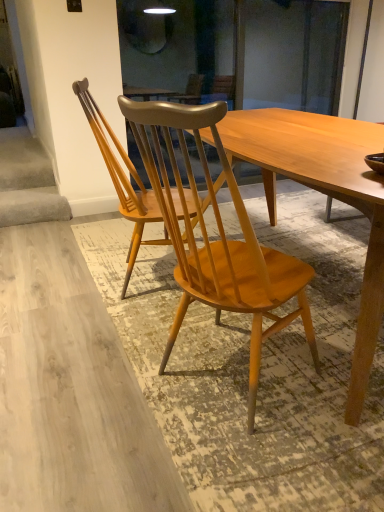
Find the location of `light brown wood chair at center, arranged as the second chair when viewed from the front`. light brown wood chair at center, arranged as the second chair when viewed from the front is located at coordinates (122, 180).

In order to face light brown wood chair at center, positioned as the 1th chair in back-to-front order, should I rotate leftwards or rightwards?

You should look left and rotate roughly 6.459 degrees.

Describe the element at coordinates (122, 180) in the screenshot. I see `light brown wood chair at center, arranged as the second chair when viewed from the front` at that location.

Where is `natural wood chair at center, acting as the first chair starting from the front`? This screenshot has width=384, height=512. natural wood chair at center, acting as the first chair starting from the front is located at coordinates (217, 240).

The image size is (384, 512). What do you see at coordinates (217, 240) in the screenshot?
I see `natural wood chair at center, arranged as the second chair when viewed from the back` at bounding box center [217, 240].

Measure the distance between point (244, 291) and camera.

Point (244, 291) and camera are 4.17 feet apart from each other.

Locate an element on the screen. The width and height of the screenshot is (384, 512). light brown wood chair at center, arranged as the second chair when viewed from the front is located at coordinates (122, 180).

Between natural wood chair at center, acting as the first chair starting from the front, and light brown wood chair at center, positioned as the 1th chair in back-to-front order, which one appears on the left side from the viewer's perspective?

light brown wood chair at center, positioned as the 1th chair in back-to-front order.

In the image, is natural wood chair at center, acting as the first chair starting from the front, positioned in front of or behind light brown wood chair at center, positioned as the 1th chair in back-to-front order?

In the image, natural wood chair at center, acting as the first chair starting from the front, appears in front of light brown wood chair at center, positioned as the 1th chair in back-to-front order.

Is point (220, 243) in front of point (149, 217)?

Yes.

From the image's perspective, between natural wood chair at center, acting as the first chair starting from the front, and light brown wood chair at center, arranged as the second chair when viewed from the front, which one is located above?

light brown wood chair at center, arranged as the second chair when viewed from the front, from the image's perspective.

From a real-world perspective, is natural wood chair at center, arranged as the second chair when viewed from the back, above or below light brown wood chair at center, arranged as the second chair when viewed from the front?

natural wood chair at center, arranged as the second chair when viewed from the back, is below light brown wood chair at center, arranged as the second chair when viewed from the front.

Which of these two, natural wood chair at center, acting as the first chair starting from the front, or light brown wood chair at center, arranged as the second chair when viewed from the front, is wider?

With larger width is light brown wood chair at center, arranged as the second chair when viewed from the front.

Considering the sizes of objects natural wood chair at center, acting as the first chair starting from the front, and light brown wood chair at center, arranged as the second chair when viewed from the front, in the image provided, who is taller, natural wood chair at center, acting as the first chair starting from the front, or light brown wood chair at center, arranged as the second chair when viewed from the front,?

Standing taller between the two is natural wood chair at center, acting as the first chair starting from the front.

Is natural wood chair at center, acting as the first chair starting from the front, bigger or smaller than light brown wood chair at center, arranged as the second chair when viewed from the front?

natural wood chair at center, acting as the first chair starting from the front, is smaller than light brown wood chair at center, arranged as the second chair when viewed from the front.

Would you say light brown wood chair at center, positioned as the 1th chair in back-to-front order, is part of natural wood chair at center, arranged as the second chair when viewed from the back,'s contents?

That's incorrect, light brown wood chair at center, positioned as the 1th chair in back-to-front order, is not inside natural wood chair at center, arranged as the second chair when viewed from the back.

Is natural wood chair at center, acting as the first chair starting from the front, beside light brown wood chair at center, positioned as the 1th chair in back-to-front order?

They are not placed beside each other.

Is natural wood chair at center, acting as the first chair starting from the front, aimed at light brown wood chair at center, arranged as the second chair when viewed from the front?

No, natural wood chair at center, acting as the first chair starting from the front, is not oriented towards light brown wood chair at center, arranged as the second chair when viewed from the front.

What's the angular difference between natural wood chair at center, arranged as the second chair when viewed from the back, and light brown wood chair at center, positioned as the 1th chair in back-to-front order,'s facing directions?

natural wood chair at center, arranged as the second chair when viewed from the back, and light brown wood chair at center, positioned as the 1th chair in back-to-front order, are facing 35.4 degrees away from each other.

Find the location of a particular element. The width and height of the screenshot is (384, 512). chair located below the light brown wood chair at center, positioned as the 1th chair in back-to-front order (from the image's perspective) is located at coordinates (217, 240).

Is light brown wood chair at center, positioned as the 1th chair in back-to-front order, at the left side of natural wood chair at center, acting as the first chair starting from the front?

Yes.

Looking at this image, which object is further away from the camera, light brown wood chair at center, arranged as the second chair when viewed from the front, or natural wood chair at center, arranged as the second chair when viewed from the back?

light brown wood chair at center, arranged as the second chair when viewed from the front, is further from the camera.

Is point (145, 197) positioned after point (300, 260)?

No, (145, 197) is in front of (300, 260).

From the image's perspective, which is below, light brown wood chair at center, positioned as the 1th chair in back-to-front order, or natural wood chair at center, arranged as the second chair when viewed from the back?

natural wood chair at center, arranged as the second chair when viewed from the back.

From a real-world perspective, is light brown wood chair at center, positioned as the 1th chair in back-to-front order, physically located above or below natural wood chair at center, acting as the first chair starting from the front?

From a real-world perspective, light brown wood chair at center, positioned as the 1th chair in back-to-front order, is physically above natural wood chair at center, acting as the first chair starting from the front.

Between light brown wood chair at center, arranged as the second chair when viewed from the front, and natural wood chair at center, acting as the first chair starting from the front, which one has larger width?

light brown wood chair at center, arranged as the second chair when viewed from the front, is wider.

Is light brown wood chair at center, arranged as the second chair when viewed from the front, taller than natural wood chair at center, arranged as the second chair when viewed from the back?

In fact, light brown wood chair at center, arranged as the second chair when viewed from the front, may be shorter than natural wood chair at center, arranged as the second chair when viewed from the back.

Which of these two, light brown wood chair at center, positioned as the 1th chair in back-to-front order, or natural wood chair at center, arranged as the second chair when viewed from the back, is bigger?

With larger size is light brown wood chair at center, positioned as the 1th chair in back-to-front order.

Is light brown wood chair at center, arranged as the second chair when viewed from the front, surrounding natural wood chair at center, arranged as the second chair when viewed from the back?

No, natural wood chair at center, arranged as the second chair when viewed from the back, is not inside light brown wood chair at center, arranged as the second chair when viewed from the front.

Is light brown wood chair at center, positioned as the 1th chair in back-to-front order, directly adjacent to natural wood chair at center, acting as the first chair starting from the front?

light brown wood chair at center, positioned as the 1th chair in back-to-front order, and natural wood chair at center, acting as the first chair starting from the front, are not in contact.

In the scene shown: Is light brown wood chair at center, arranged as the second chair when viewed from the front, turned away from natural wood chair at center, acting as the first chair starting from the front?

That's not correct — light brown wood chair at center, arranged as the second chair when viewed from the front, is not looking away from natural wood chair at center, acting as the first chair starting from the front.

How distant is light brown wood chair at center, arranged as the second chair when viewed from the front, from natural wood chair at center, acting as the first chair starting from the front?

light brown wood chair at center, arranged as the second chair when viewed from the front, and natural wood chair at center, acting as the first chair starting from the front, are 27.47 inches apart from each other.

The height and width of the screenshot is (512, 384). What are the coordinates of `chair above the natural wood chair at center, acting as the first chair starting from the front (from a real-world perspective)` in the screenshot? It's located at point(122,180).

In order to click on chair on the left of natural wood chair at center, acting as the first chair starting from the front in this screenshot , I will do tap(122, 180).

Identify the location of chair above the natural wood chair at center, acting as the first chair starting from the front (from the image's perspective). (122, 180).